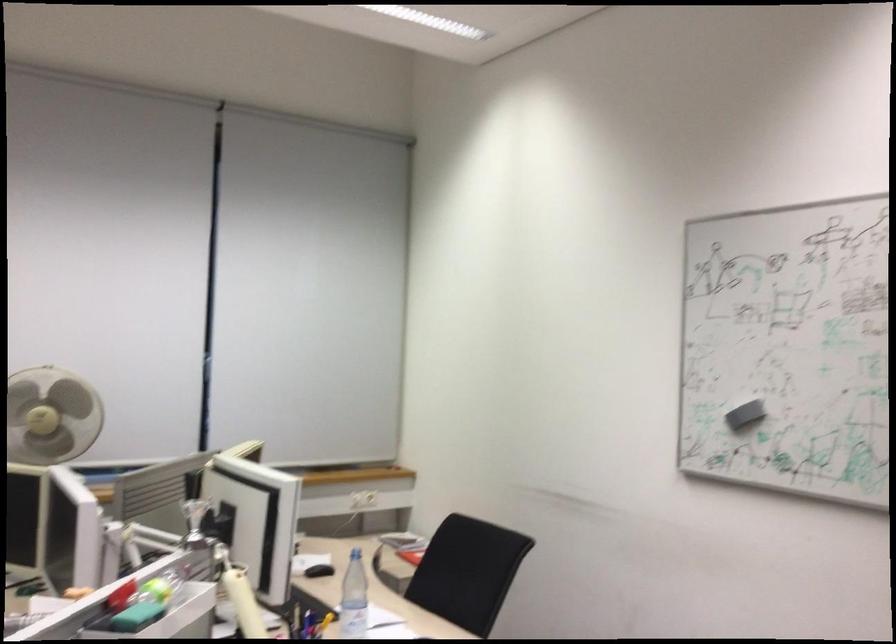
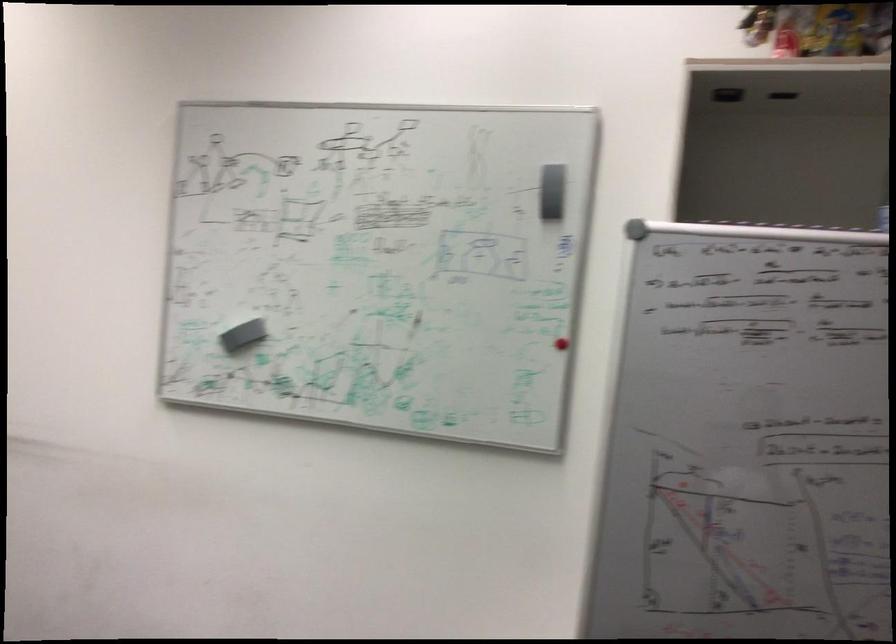
Where in the second image is the point corresponding to point (743, 409) from the first image?

(239, 330)